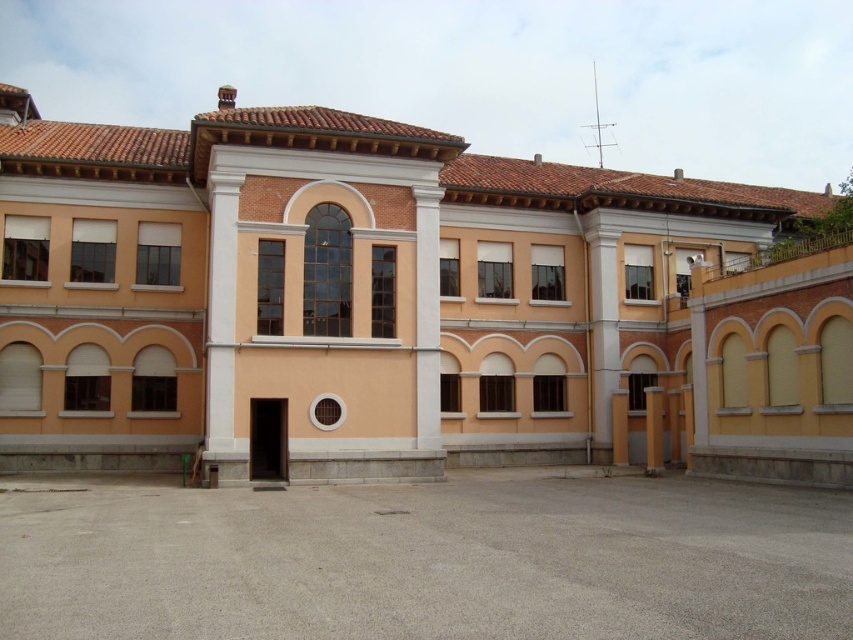
Question: Which object appears farthest from the camera in this image?

Choices:
 (A) yellow matte pillar at lower right
 (B) yellow concrete pillar at center

Answer: (B)

Question: Is yellow matte pillar at lower right bigger than yellow concrete pillar at center?

Choices:
 (A) yes
 (B) no

Answer: (A)

Question: Which of the following is the closest to the observer?

Choices:
 (A) (622, 392)
 (B) (647, 442)

Answer: (B)

Question: Can you confirm if yellow matte pillar at lower right is smaller than yellow concrete pillar at center?

Choices:
 (A) no
 (B) yes

Answer: (A)

Question: Among these points, which one is farthest from the camera?

Choices:
 (A) (625, 420)
 (B) (654, 456)

Answer: (A)

Question: Is yellow matte pillar at lower right wider than yellow concrete pillar at center?

Choices:
 (A) no
 (B) yes

Answer: (B)